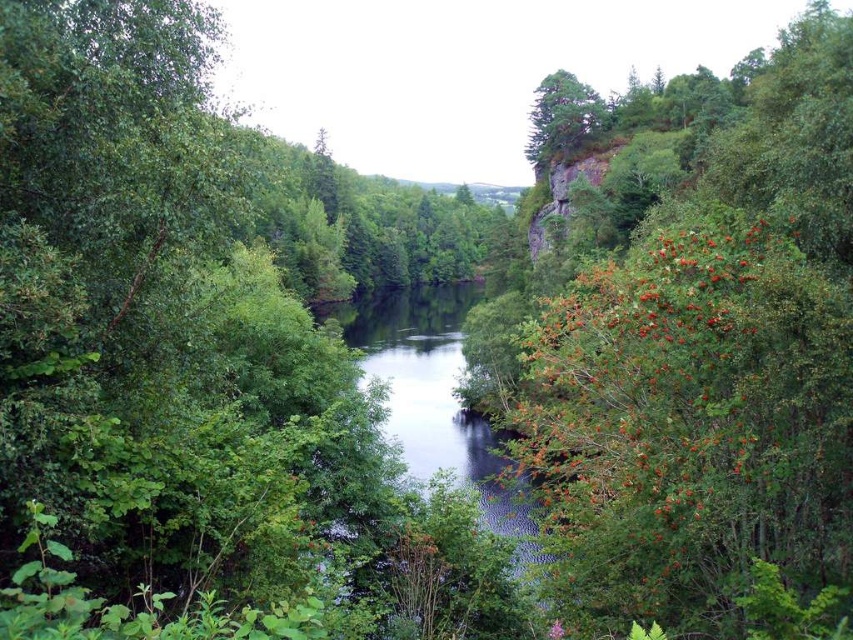
Between clear water at center and green rough bark tree at upper center, which one is positioned higher?

green rough bark tree at upper center is higher up.

Which of these two, clear water at center or green rough bark tree at upper center, stands shorter?

green rough bark tree at upper center

Between point (434, 365) and point (556, 156), which one is positioned in front?

Point (556, 156) is more forward.

What are the coordinates of `clear water at center` in the screenshot? It's located at (434, 394).

Based on the photo, which of these two, green leafy tree at right or clear water at center, stands shorter?

clear water at center

Which is behind, point (650, 221) or point (431, 442)?

Point (431, 442)

Identify the location of green leafy tree at right. (693, 356).

Does point (711, 298) come behind point (561, 106)?

No.

Can you confirm if green leafy tree at right is taller than green rough bark tree at upper center?

Indeed, green leafy tree at right has a greater height compared to green rough bark tree at upper center.

Measure the distance between point (700, 97) and camera.

They are 77.73 meters apart.

You are a GUI agent. You are given a task and a screenshot of the screen. Output one action in this format:
    pyautogui.click(x=<x>, y=<y>)
    Task: Click on the green leafy tree at right
    The height and width of the screenshot is (640, 853).
    Given the screenshot: What is the action you would take?
    pyautogui.click(x=693, y=356)